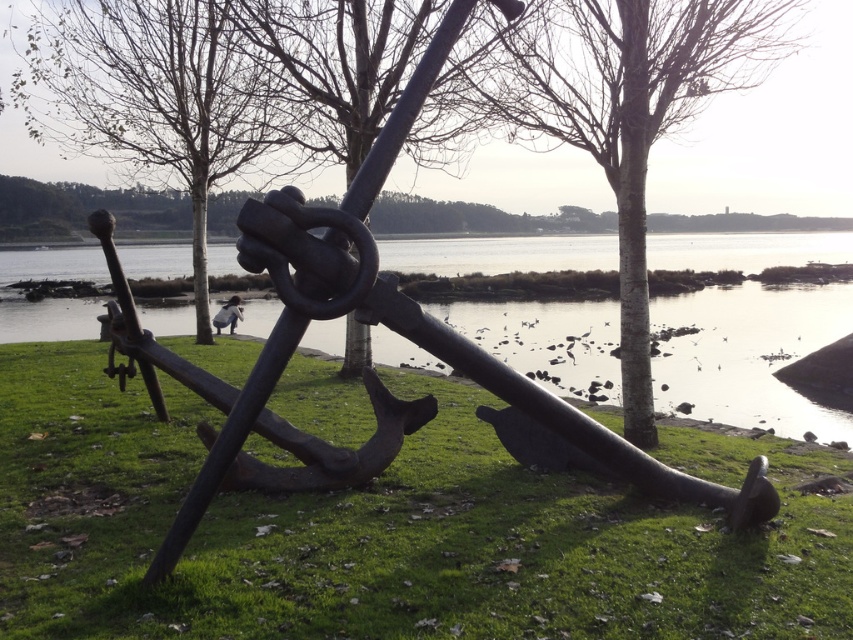
You are standing at the edge of the water and want to walk towards the green grass at center and the bare wood tree at center. Which one will you encounter first?

The green grass at center will be encountered first because its width is narrower than the bare wood tree at center, meaning it is closer to the observer.

You are standing in the scene and want to walk from the green grass at center to the bare wood tree at center. Which direction should you move to get closer to the tree?

You should move away from the viewer since the green grass at center is closer to you than the bare wood tree at center, meaning the tree is further back. To reach it, you need to walk towards the background away from the viewer.

Based on the photo, you are standing in the scene and want to place a small bench between the bare wood tree at center and the brown wood tree at center. Can you fit the bench between them?

The bare wood tree at center is positioned under the brown wood tree at center, so they are vertically aligned. This means there is little horizontal space between them, making it difficult to fit a bench between them.